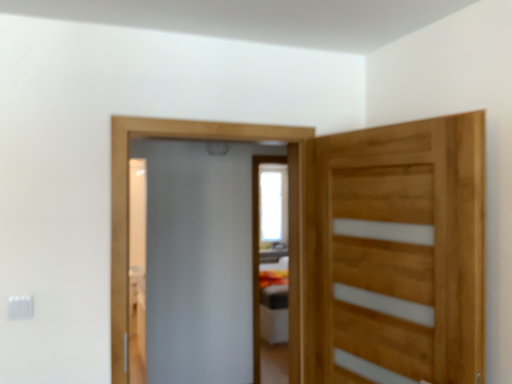
Question: Which direction should I rotate to face frosted glass screen door at center, the second screen door from the back, — up or down?

Choices:
 (A) up
 (B) down

Answer: (B)

Question: Is natural wood door at right not near frosted glass screen door at center, the second screen door from the back?

Choices:
 (A) no
 (B) yes

Answer: (B)

Question: Is the depth of natural wood door at right greater than that of frosted glass screen door at center, the second screen door from the back?

Choices:
 (A) yes
 (B) no

Answer: (B)

Question: Considering the relative sizes of natural wood door at right and frosted glass screen door at center, the second screen door from the back, in the image provided, is natural wood door at right thinner than frosted glass screen door at center, the second screen door from the back,?

Choices:
 (A) no
 (B) yes

Answer: (B)

Question: Is the depth of natural wood door at right less than that of frosted glass screen door at center, the second screen door from the back?

Choices:
 (A) yes
 (B) no

Answer: (A)

Question: Is natural wood door at right with frosted glass screen door at center, the second screen door from the back?

Choices:
 (A) yes
 (B) no

Answer: (B)

Question: Does natural wood door at right appear on the left side of frosted glass screen door at center, the 1th screen door positioned from the front?

Choices:
 (A) no
 (B) yes

Answer: (A)

Question: Would you say white glossy screen door at center, the second screen door positioned from the front, is part of frosted glass screen door at center, the 1th screen door positioned from the front,'s contents?

Choices:
 (A) no
 (B) yes

Answer: (A)

Question: Considering the relative sizes of frosted glass screen door at center, the 1th screen door positioned from the front, and white glossy screen door at center, which is the first screen door from back to front, in the image provided, is frosted glass screen door at center, the 1th screen door positioned from the front, bigger than white glossy screen door at center, which is the first screen door from back to front,?

Choices:
 (A) yes
 (B) no

Answer: (B)

Question: Considering the relative sizes of frosted glass screen door at center, the second screen door from the back, and white glossy screen door at center, the second screen door positioned from the front, in the image provided, is frosted glass screen door at center, the second screen door from the back, wider than white glossy screen door at center, the second screen door positioned from the front,?

Choices:
 (A) no
 (B) yes

Answer: (A)

Question: Is frosted glass screen door at center, the second screen door from the back, oriented away from white glossy screen door at center, the second screen door positioned from the front?

Choices:
 (A) no
 (B) yes

Answer: (A)

Question: Is frosted glass screen door at center, the 1th screen door positioned from the front, not within white glossy screen door at center, the second screen door positioned from the front?

Choices:
 (A) no
 (B) yes

Answer: (B)

Question: Can you confirm if frosted glass screen door at center, the 1th screen door positioned from the front, is positioned to the left of white glossy screen door at center, which is the first screen door from back to front?

Choices:
 (A) no
 (B) yes

Answer: (B)

Question: From a real-world perspective, is white glossy screen door at center, the second screen door positioned from the front, positioned under natural wood door at right based on gravity?

Choices:
 (A) yes
 (B) no

Answer: (A)